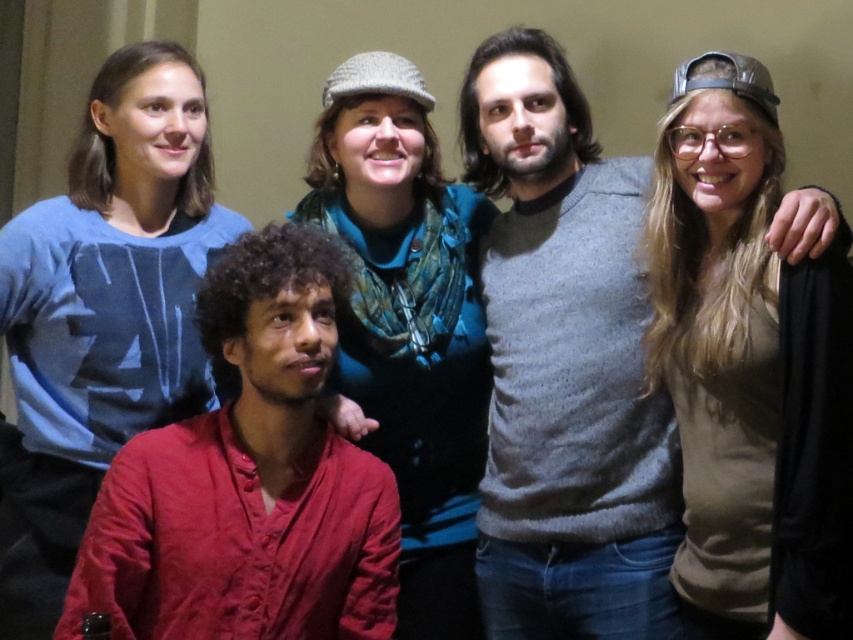
You are standing in front of the group photo described. You want to find the red linen shirt at lower left. Based on the coordinates provided, can you confirm if the point marked at (248,480) is the correct location for the red linen shirt at lower left?

Yes, the point marked at (248,480) is the correct location for the red linen shirt at lower left as indicated in the description.

You are standing in front of the group photo and want to know the position of the red linen shirt at lower left relative to the knitted wool hat at upper center. Can you determine if it is above or below?

The red linen shirt at lower left is below the knitted wool hat at upper center according to the description.

You are standing at the point labeled as point (469, 83) in the image. If you want to move 3 meters forward in the direction you are facing, will you exit the room?

The distance between you and the viewer is 2.09 meters, so moving 3 meters forward would take you beyond the room since the distance to the viewer is less than 3 meters.